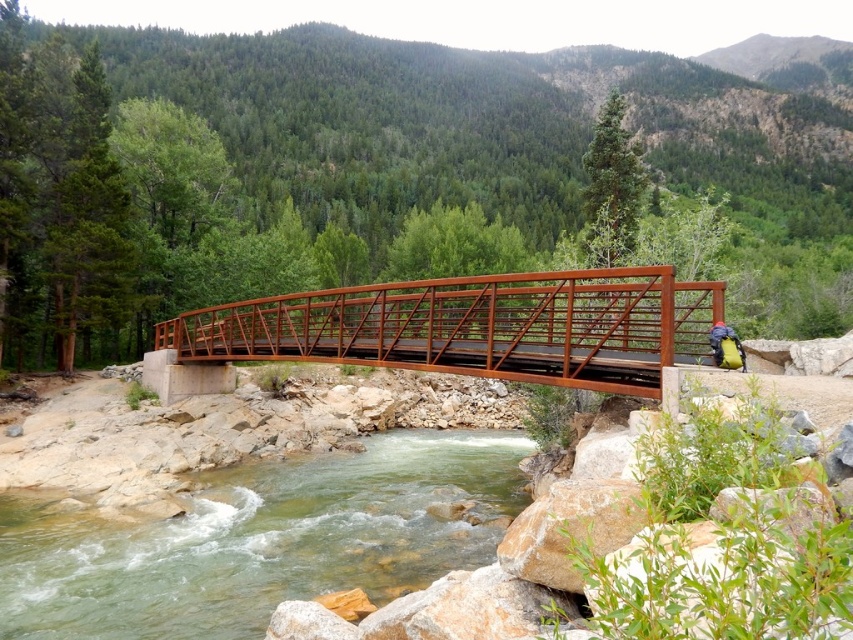
You are a hiker planning to cross the river using the rustic metal bridge at center. You need to know if the green smooth water at center is wider than the bridge. Is it?

The green smooth water at center has a smaller size compared to rustic metal bridge at center, so the water is narrower than the bridge. Therefore, the bridge spans the river, and you can safely cross using the rustic metal bridge at center.